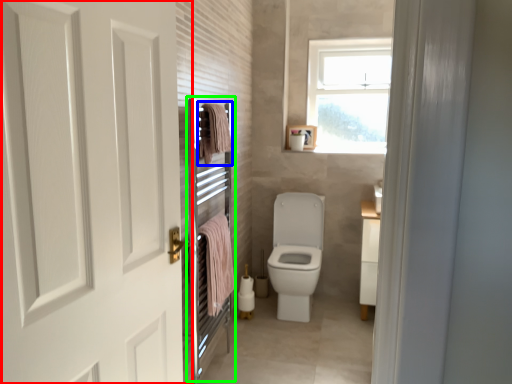
Question: Based on their relative distances, which object is nearer to door (highlighted by a red box)? Choose from bath towel (highlighted by a blue box) and screen door (highlighted by a green box).

Choices:
 (A) bath towel
 (B) screen door

Answer: (B)